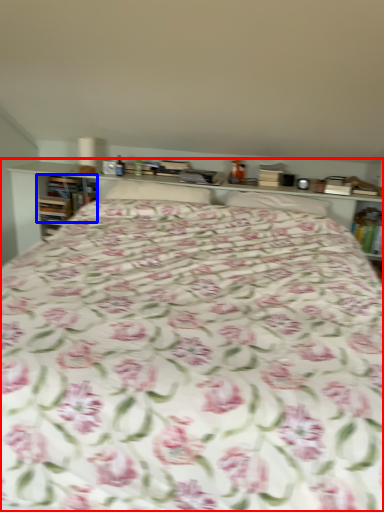
Question: Which point is closer to the camera, bed (highlighted by a red box) or book (highlighted by a blue box)?

Choices:
 (A) bed
 (B) book

Answer: (A)